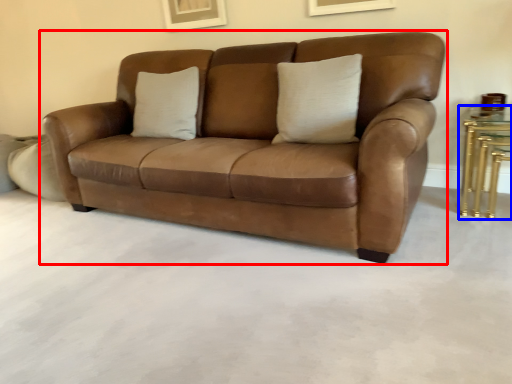
Question: Which object is further to the camera taking this photo, studio couch (highlighted by a red box) or table (highlighted by a blue box)?

Choices:
 (A) studio couch
 (B) table

Answer: (B)